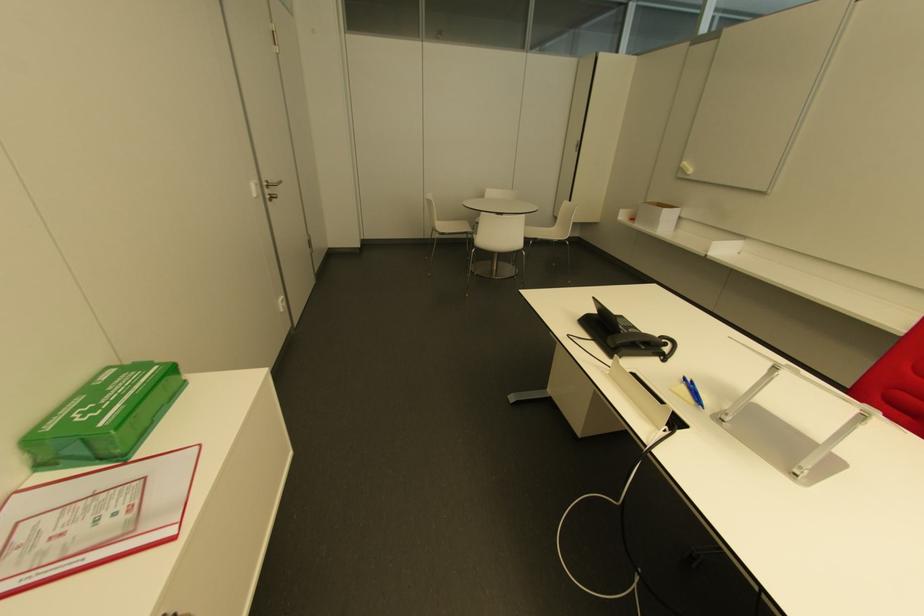
The image size is (924, 616). Find the location of `metal door handle`. metal door handle is located at coordinates (272, 184).